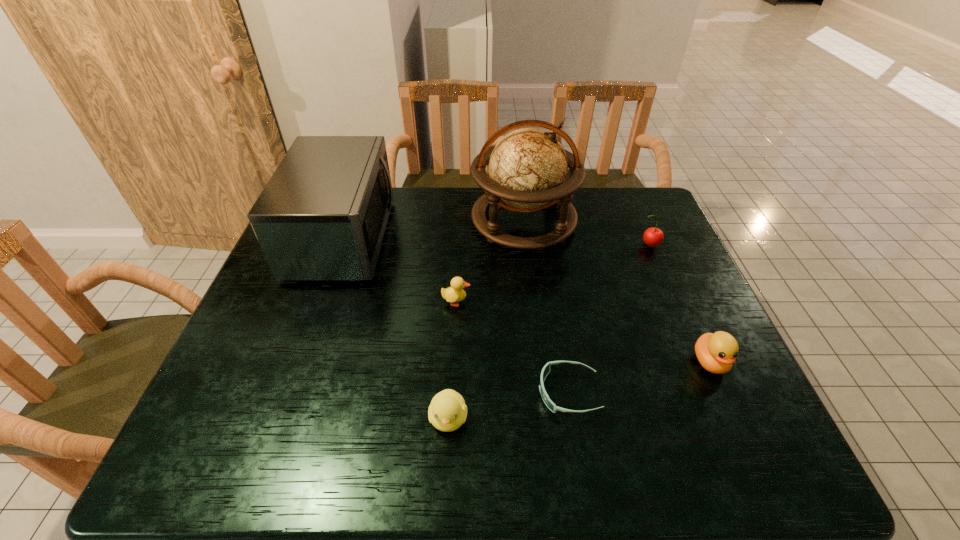
Find the location of a particular element. The width and height of the screenshot is (960, 540). unoccupied area between the microwave oven and the fourth nearest object is located at coordinates (400, 270).

Where is `free space between the nearest duckling and the second farthest duckling`? This screenshot has height=540, width=960. free space between the nearest duckling and the second farthest duckling is located at coordinates (579, 390).

In order to click on free spot between the globe and the second nearest duckling in this screenshot , I will do `click(616, 292)`.

I want to click on free area in between the farthest duckling and the second farthest duckling, so click(583, 332).

What are the coordinates of `free spot between the second farthest duckling and the tallest object` in the screenshot? It's located at click(616, 292).

Find the location of a particular element. This screenshot has width=960, height=540. vacant area between the fourth nearest object and the second nearest duckling is located at coordinates (583, 332).

Find the location of a particular element. The width and height of the screenshot is (960, 540). vacant space that's between the farthest duckling and the globe is located at coordinates (490, 261).

The image size is (960, 540). In order to click on empty space that is in between the rightmost duckling and the cherry in this screenshot , I will do `click(679, 303)`.

Identify which object is located as the nearest to the leftmost object. Please provide its 2D coordinates. Your answer should be formatted as a tuple, i.e. [(x, y)], where the tuple contains the x and y coordinates of a point satisfying the conditions above.

[(455, 293)]

Where is `the second closest object to the fifth shortest object`? Image resolution: width=960 pixels, height=540 pixels. the second closest object to the fifth shortest object is located at coordinates (716, 352).